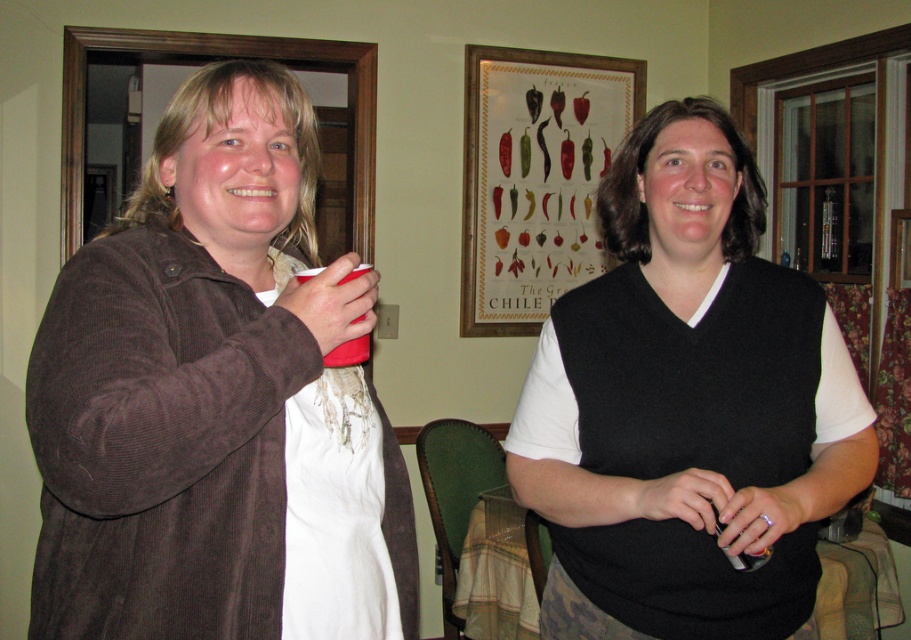
Question: Which of the following is the closest to the observer?

Choices:
 (A) black sweater at center
 (B) brown corduroy jacket at left
 (C) white lace apron at left

Answer: (B)

Question: Is brown corduroy jacket at left bigger than black sweater at center?

Choices:
 (A) yes
 (B) no

Answer: (A)

Question: Does brown corduroy jacket at left appear on the right side of black sweater at center?

Choices:
 (A) no
 (B) yes

Answer: (A)

Question: Which point appears closest to the camera in this image?

Choices:
 (A) (367, 566)
 (B) (96, 266)

Answer: (B)

Question: From the image, what is the correct spatial relationship of brown corduroy jacket at left in relation to black sweater at center?

Choices:
 (A) right
 (B) left

Answer: (B)

Question: Among these objects, which one is farthest from the camera?

Choices:
 (A) brown corduroy jacket at left
 (B) white lace apron at left
 (C) black sweater at center

Answer: (C)